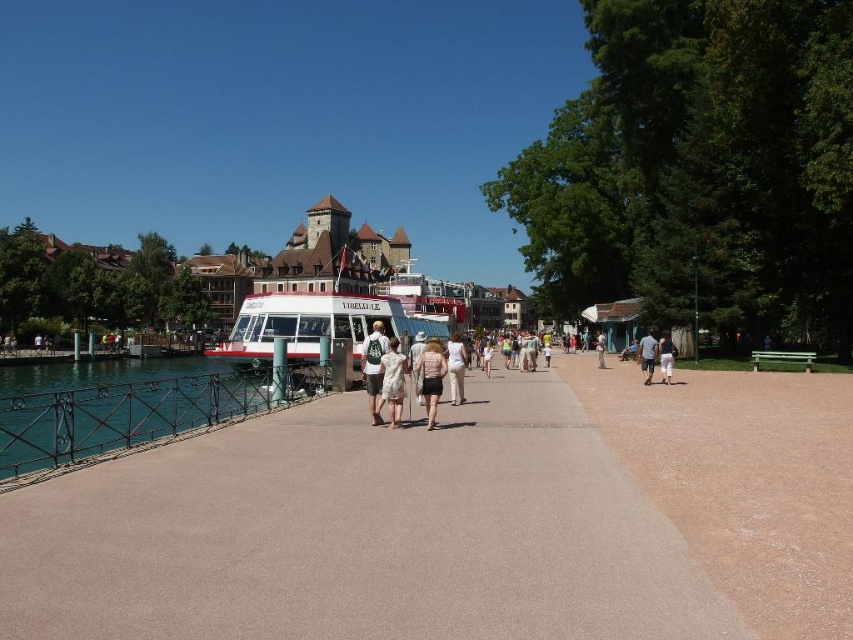
Question: Estimate the real-world distances between objects in this image. Which object is closer to the pink fabric dress at center?

Choices:
 (A) white cotton backpack at center
 (B) white matte boat at center
 (C) dark blue jeans at center
 (D) light beige pants at center

Answer: (A)

Question: Which point appears farthest from the camera in this image?

Choices:
 (A) click(809, 358)
 (B) click(294, 355)
 (C) click(453, 339)

Answer: (B)

Question: Can you confirm if white cotton backpack at center is wider than pink fabric dress at center?

Choices:
 (A) yes
 (B) no

Answer: (A)

Question: Considering the relative positions of brown gravel path at right and pink fabric dress at center in the image provided, where is brown gravel path at right located with respect to pink fabric dress at center?

Choices:
 (A) above
 (B) below

Answer: (B)

Question: Which point is closer to the camera?

Choices:
 (A) brown concrete pavement at center
 (B) dark blue jeans at center

Answer: (A)

Question: Is blue fabric shirt at center bigger than dark blue jeans at center?

Choices:
 (A) yes
 (B) no

Answer: (A)